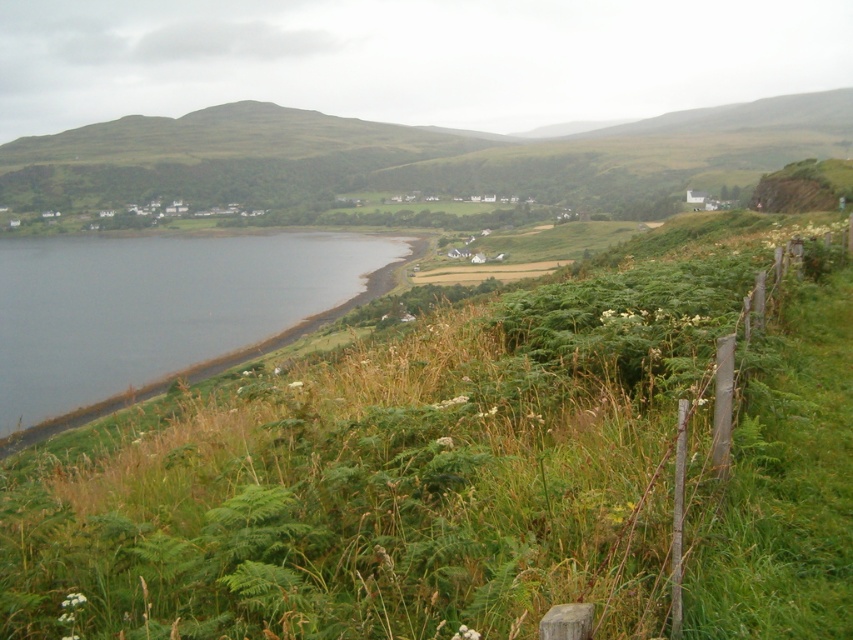
You are a gardener planning to plant a row of flowers along the green grassy at lower left and dark gray water at lower left. Which area has more space available for planting?

The dark gray water at lower left has more space available for planting because the green grassy at lower left is thinner, indicating less area.

You are a gardener planning to plant a row of flowers along the edge of the green grassy at lower left and the wooden post fence at right. Based on the scene, which area has more space for planting?

The green grassy at lower left might be wider than the wooden post fence at right, so there is more space for planting flowers along the green grassy at lower left.

In the scene shown: You are standing at the edge of the green grassy at lower left and want to walk to the wooden post fence at right. Which direction should you head towards?

Since the green grassy at lower left is to the left of wooden post fence at right, you should head towards the right direction to reach the wooden post fence at right.